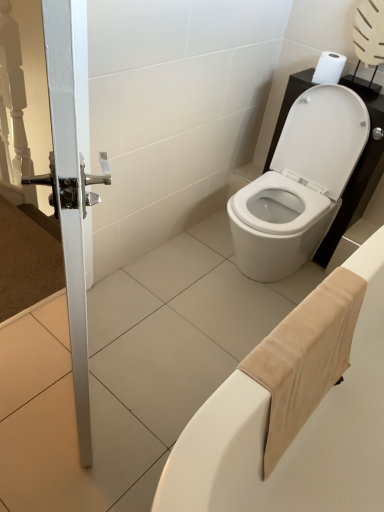
Question: Considering the positions of white glossy toilet at center and beige fabric towel at lower right in the image, is white glossy toilet at center bigger or smaller than beige fabric towel at lower right?

Choices:
 (A) big
 (B) small

Answer: (B)

Question: From a real-world perspective, relative to beige fabric towel at lower right, is white glossy toilet at center vertically above or below?

Choices:
 (A) below
 (B) above

Answer: (B)

Question: Which object is the farthest from the white matte toilet paper at upper right?

Choices:
 (A) white glossy door handle at left
 (B) beige fabric towel at lower right
 (C) white glossy toilet at center

Answer: (A)

Question: Estimate the real-world distances between objects in this image. Which object is closer to the white matte toilet paper at upper right?

Choices:
 (A) white glossy door handle at left
 (B) beige fabric towel at lower right
 (C) white glossy toilet at center

Answer: (C)